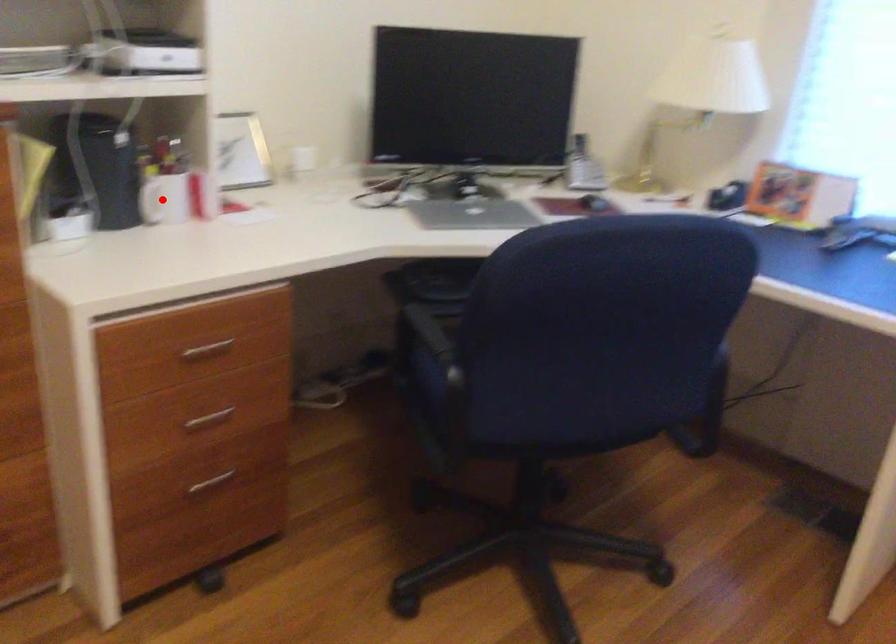
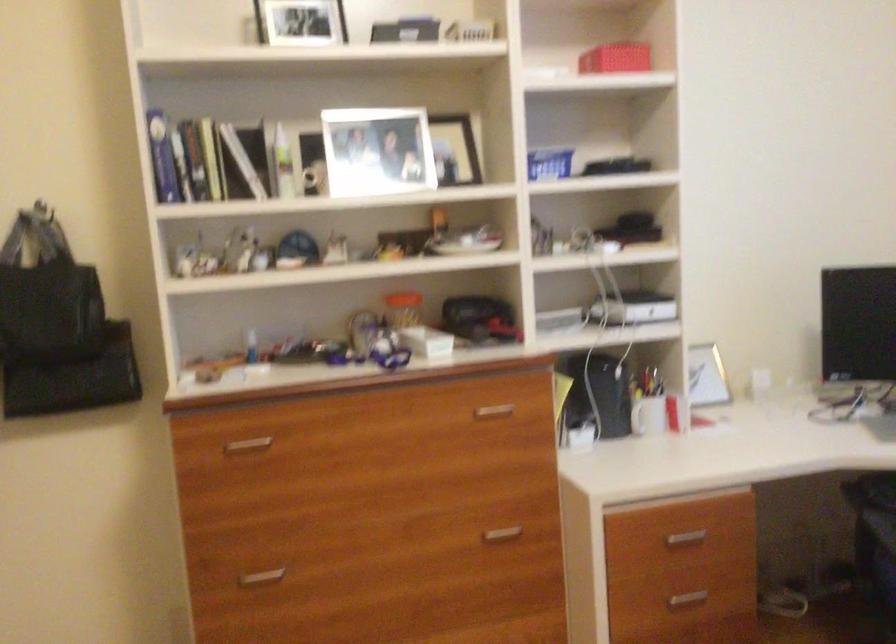
Locate, in the second image, the point that corresponds to the highlighted location in the first image.

(649, 415)